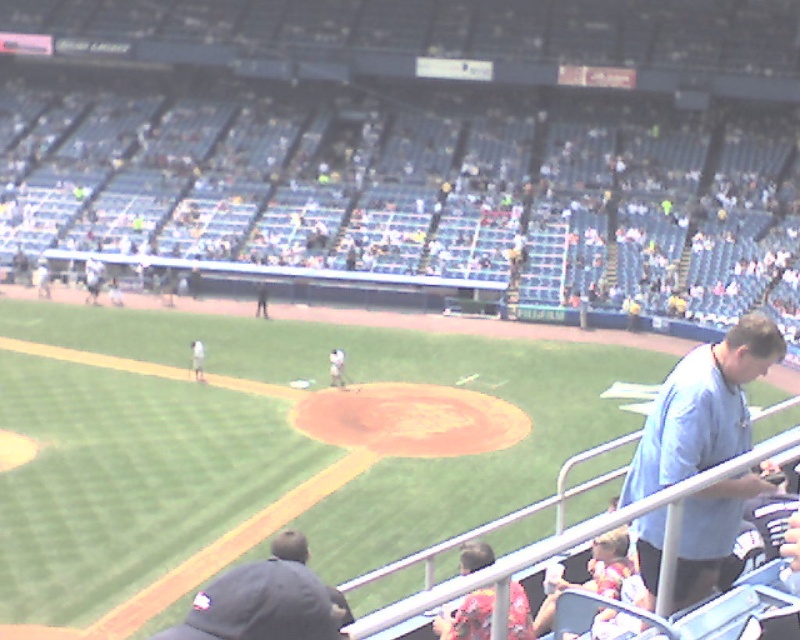
You are a photographer trying to capture a photo of the light blue shirt at right without including the light blue seats at upper center. Based on their sizes, which object would require you to zoom in more to frame properly?

The light blue shirt at right is smaller than the light blue seats at upper center, so you would need to zoom in more to frame the light blue shirt at right properly.

You are a photographer standing at the edge of the baseball field. You want to take a photo of the dark gray baseball cap at lower left without the light blue seats at upper center blocking the view. Is it possible to do so?

The dark gray baseball cap at lower left is behind the light blue seats at upper center, so it is currently blocked by them. To capture the dark gray baseball cap at lower left without obstruction, you would need to move to a position where the light blue seats at upper center are not between you and the cap.